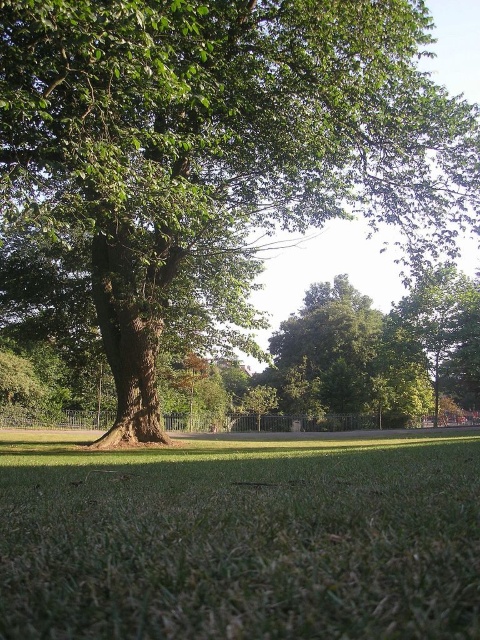
Question: Does green grassy at center come behind green leafy tree at upper right?

Choices:
 (A) yes
 (B) no

Answer: (B)

Question: Is green leafy tree at center to the left of green grassy at center from the viewer's perspective?

Choices:
 (A) no
 (B) yes

Answer: (A)

Question: Which of these objects is positioned farthest from the green leafy tree at center?

Choices:
 (A) green leafy tree at upper right
 (B) green grassy at center

Answer: (A)

Question: Which point is farther to the camera?

Choices:
 (A) (355, 44)
 (B) (215, 454)
 (C) (414, 349)

Answer: (C)

Question: Does green grassy at center have a lesser width compared to green leafy tree at upper right?

Choices:
 (A) no
 (B) yes

Answer: (B)

Question: Which of the following is the farthest from the observer?

Choices:
 (A) green grassy at center
 (B) green leafy tree at center

Answer: (B)